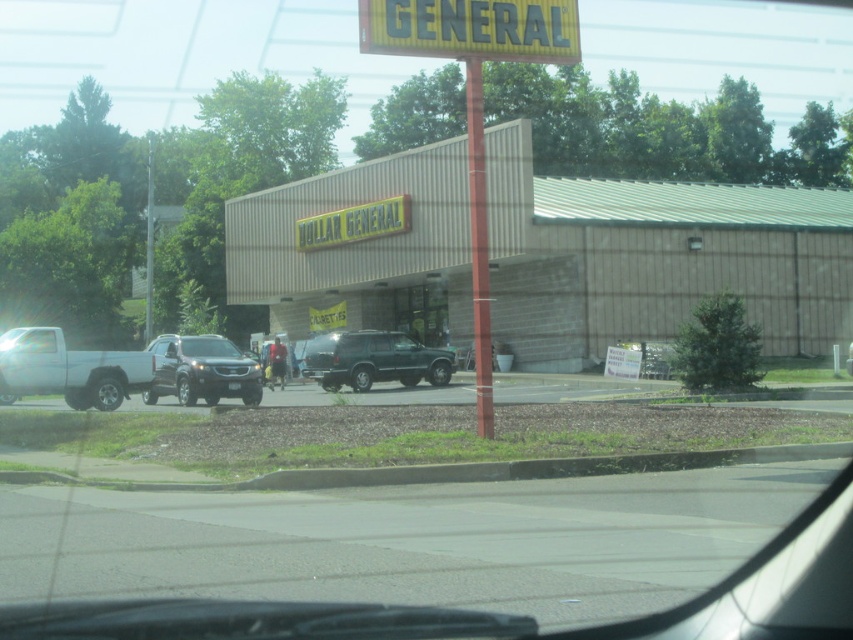
Does beige/textured building at center have a lesser width compared to metallic green suv at center?

In fact, beige/textured building at center might be wider than metallic green suv at center.

Who is taller, beige/textured building at center or metallic green suv at center?

With more height is beige/textured building at center.

This screenshot has width=853, height=640. Find the location of `beige/textured building at center`. beige/textured building at center is located at coordinates (654, 259).

I want to click on beige/textured building at center, so click(654, 259).

Can you confirm if metallic green suv at center is positioned below satin black suv at center?

Correct, metallic green suv at center is located below satin black suv at center.

Who is positioned more to the right, metallic green suv at center or satin black suv at center?

From the viewer's perspective, metallic green suv at center appears more on the right side.

Does point (422, 356) come in front of point (202, 340)?

No, (422, 356) is behind (202, 340).

Find the location of a particular element. This screenshot has width=853, height=640. metallic green suv at center is located at coordinates (374, 360).

Between white matte truck at left and metallic green suv at center, which one appears on the left side from the viewer's perspective?

white matte truck at left

Is white matte truck at left smaller than metallic green suv at center?

Actually, white matte truck at left might be larger than metallic green suv at center.

At what (x,y) coordinates should I click in order to perform the action: click on white matte truck at left. Please return your answer as a coordinate pair (x, y). The image size is (853, 640). Looking at the image, I should click on (68, 369).

You are a GUI agent. You are given a task and a screenshot of the screen. Output one action in this format:
    pyautogui.click(x=<x>, y=<y>)
    Task: Click on the white matte truck at left
    The width and height of the screenshot is (853, 640).
    Given the screenshot: What is the action you would take?
    pyautogui.click(x=68, y=369)